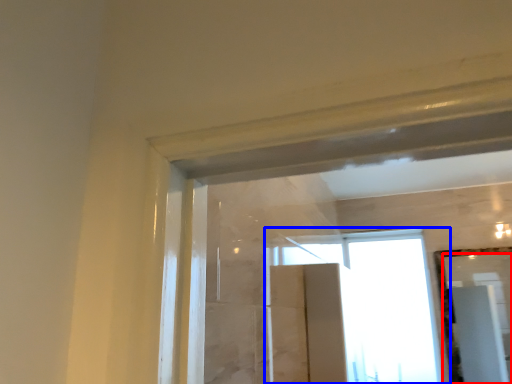
Question: Which of the following is the farthest to the observer, mirror (highlighted by a red box) or window (highlighted by a blue box)?

Choices:
 (A) mirror
 (B) window

Answer: (B)